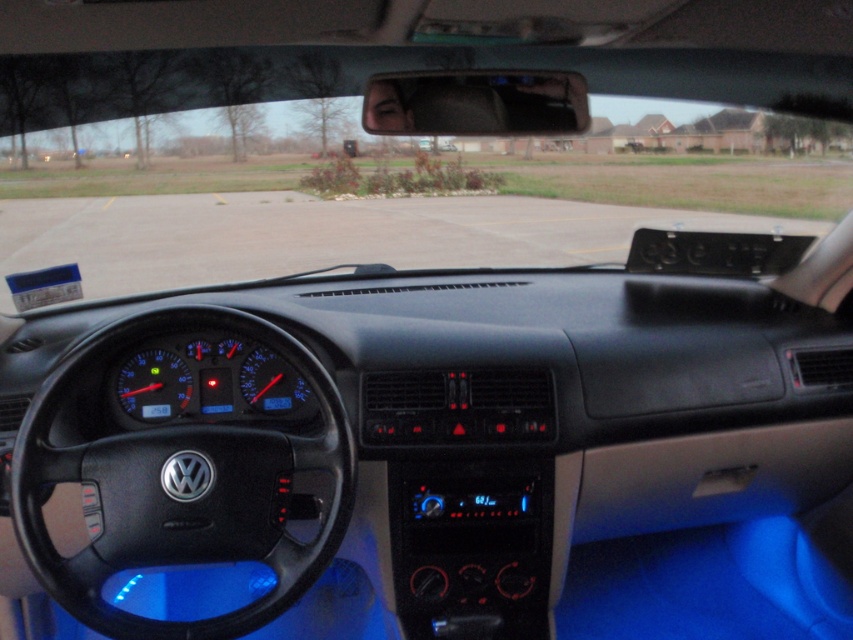
You are sitting in the driver seat of the Volkswagen car. You need to look through the transparent glass windshield at center to see the road ahead. However, the black leather steering wheel at left is blocking your view. Which object should you adjust to improve your visibility?

The transparent glass windshield at center is positioned on the left side of the black leather steering wheel at left, so adjusting the black leather steering wheel at left would help improve visibility by moving it out of the way.

You are sitting in the driver seat of the Volkswagen vehicle shown. You need to check both the transparent glass windshield at center and the black leather steering wheel at left. Which one has a bigger size?

The transparent glass windshield at center has a larger size compared to the black leather steering wheel at left.

You are a driver sitting in the Volkswagen vehicle. You need to reach the transparent glass windshield at center from your current position at the black leather steering wheel at left. Is the distance sufficient to stretch your arm fully without moving from your seat?

The distance between the transparent glass windshield at center and the black leather steering wheel at left is 17.58 feet. Since this distance is much greater than the typical human arm length of around 2.5 feet, you cannot stretch your arm fully to reach the transparent glass windshield at center from the black leather steering wheel at left without moving from your seat.